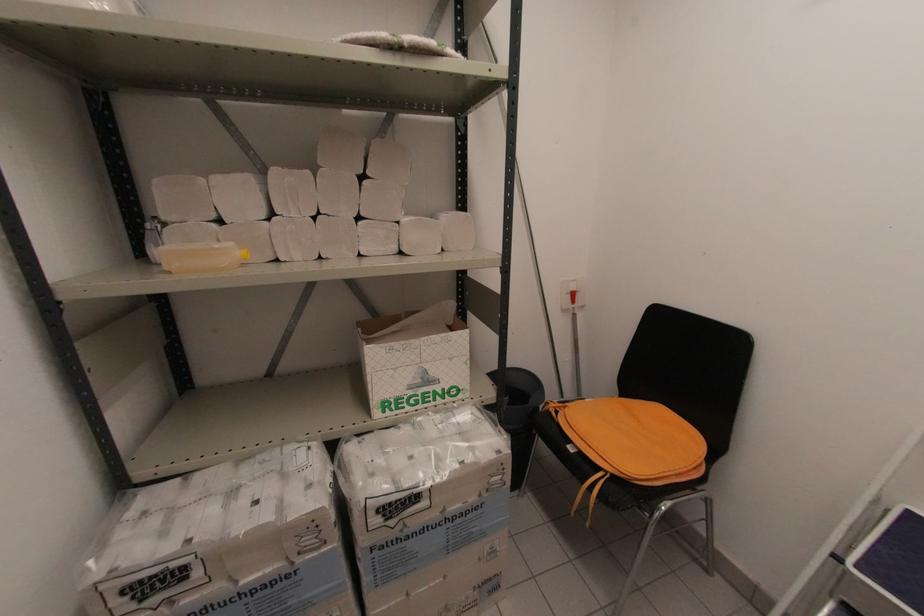
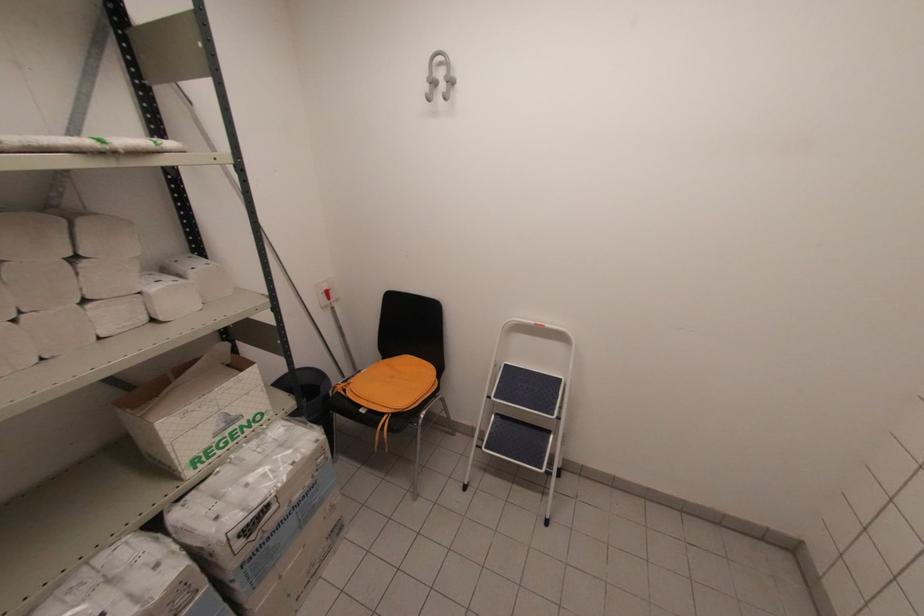
Where in the second image is the point corresponding to (x=419, y=381) from the first image?

(224, 426)